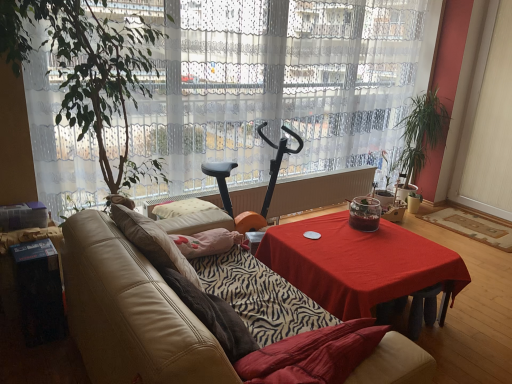
This screenshot has height=384, width=512. In order to click on white plastic radiator at center in this screenshot , I will do `click(319, 190)`.

Where is `transparent glass jar at center`? transparent glass jar at center is located at coordinates (364, 214).

In the scene shown: Measure the distance between point (266, 194) and camera.

A distance of 3.46 meters exists between point (266, 194) and camera.

Where is `red cloth-covered table at center`? The image size is (512, 384). red cloth-covered table at center is located at coordinates (358, 263).

Where is `leather couch at center`? leather couch at center is located at coordinates (131, 313).

Describe the element at coordinates (276, 84) in the screenshot. I see `white sheer curtain at center` at that location.

In order to click on green leafy plant at right, the 1th houseplant when ordered from back to front in this screenshot , I will do `click(421, 132)`.

Is white sheer curtain at center located within transparent glass jar at center?

No, transparent glass jar at center does not contain white sheer curtain at center.

Is transparent glass jar at center far away from white sheer curtain at center?

Yes, transparent glass jar at center and white sheer curtain at center are located far from each other.

From the picture: Which object is wider, transparent glass jar at center or white sheer curtain at center?

Wider between the two is white sheer curtain at center.

From a real-world perspective, is transparent glass jar at center physically located above or below white sheer curtain at center?

In terms of real-world spatial position, transparent glass jar at center is below white sheer curtain at center.

Which of these two, green leafy plant at right, the 1th houseplant when ordered from back to front, or green leafy plant at left, arranged as the first houseplant when viewed from the left, is thinner?

green leafy plant at right, the 1th houseplant when ordered from back to front, is thinner.

Is green leafy plant at right, the 1th houseplant viewed from the right, to the right of green leafy plant at left, arranged as the 1th houseplant when viewed from the front, from the viewer's perspective?

Indeed, green leafy plant at right, the 1th houseplant viewed from the right, is positioned on the right side of green leafy plant at left, arranged as the 1th houseplant when viewed from the front.

Locate an element on the screen. The width and height of the screenshot is (512, 384). houseplant above the green leafy plant at right, the second houseplant when ordered from left to right (from a real-world perspective) is located at coordinates (88, 71).

Looking at the image, does green leafy plant at right, the 1th houseplant viewed from the right, seem bigger or smaller compared to green leafy plant at left, placed as the 2th houseplant when sorted from back to front?

green leafy plant at right, the 1th houseplant viewed from the right, is smaller than green leafy plant at left, placed as the 2th houseplant when sorted from back to front.

Would you say black plastic exercise bike at center is to the left or to the right of leather couch at center in the picture?

Based on their positions, black plastic exercise bike at center is located to the right of leather couch at center.

Consider the image. From a real-world perspective, is black plastic exercise bike at center positioned over leather couch at center based on gravity?

Yes, from a real-world perspective, black plastic exercise bike at center is above leather couch at center.

Is black plastic exercise bike at center spatially inside leather couch at center, or outside of it?

black plastic exercise bike at center is spatially situated outside leather couch at center.

Is black plastic exercise bike at center smaller than leather couch at center?

Correct, black plastic exercise bike at center occupies less space than leather couch at center.

Is white sheer curtain at center directly adjacent to green leafy plant at left, placed as the 2th houseplant when sorted from back to front?

No.

Is white sheer curtain at center bigger or smaller than green leafy plant at left, arranged as the first houseplant when viewed from the left?

In the image, white sheer curtain at center appears to be larger than green leafy plant at left, arranged as the first houseplant when viewed from the left.

Looking at this image, from a real-world perspective, is white sheer curtain at center positioned over green leafy plant at left, arranged as the first houseplant when viewed from the left, based on gravity?

Correct, in the physical world, white sheer curtain at center is higher than green leafy plant at left, arranged as the first houseplant when viewed from the left.

Between white sheer curtain at center and green leafy plant at left, placed as the 2th houseplant when sorted from back to front, which one has larger width?

green leafy plant at left, placed as the 2th houseplant when sorted from back to front, is wider.

Between black plastic exercise bike at center and green leafy plant at right, the 1th houseplant viewed from the right, which one has smaller size?

Smaller between the two is green leafy plant at right, the 1th houseplant viewed from the right.

Is black plastic exercise bike at center facing towards green leafy plant at right, which is the second houseplant from front to back?

No, black plastic exercise bike at center is not aimed at green leafy plant at right, which is the second houseplant from front to back.

Which object is wider, black plastic exercise bike at center or green leafy plant at right, the 1th houseplant when ordered from back to front?

Wider between the two is black plastic exercise bike at center.

Considering the positions of objects black plastic exercise bike at center and green leafy plant at right, which is the second houseplant from front to back, in the image provided, who is more to the left, black plastic exercise bike at center or green leafy plant at right, which is the second houseplant from front to back,?

From the viewer's perspective, black plastic exercise bike at center appears more on the left side.

Between white plastic radiator at center and transparent glass jar at center, which one appears on the left side from the viewer's perspective?

white plastic radiator at center.

Is white plastic radiator at center spatially inside transparent glass jar at center, or outside of it?

white plastic radiator at center is outside transparent glass jar at center.

Is white plastic radiator at center aimed at transparent glass jar at center?

Yes.

From a real-world perspective, relative to transparent glass jar at center, is white plastic radiator at center vertically above or below?

white plastic radiator at center is situated lower than transparent glass jar at center in the real world.

Which object is further away from the camera, green leafy plant at left, placed as the 2th houseplant when sorted from back to front, or white plastic radiator at center?

white plastic radiator at center is more distant.

Looking at this image, which is less distant, (133,38) or (292,206)?

Clearly, point (133,38) is closer to the camera than point (292,206).

Considering the sizes of green leafy plant at left, placed as the 2th houseplant when sorted from right to left, and white plastic radiator at center in the image, is green leafy plant at left, placed as the 2th houseplant when sorted from right to left, wider or thinner than white plastic radiator at center?

Clearly, green leafy plant at left, placed as the 2th houseplant when sorted from right to left, has more width compared to white plastic radiator at center.

Find the location of a particular element. This screenshot has width=512, height=384. curtain on the left of transparent glass jar at center is located at coordinates (276, 84).

At what (x,y) coordinates should I click in order to perform the action: click on houseplant directly beneath the green leafy plant at left, placed as the 2th houseplant when sorted from back to front (from a real-world perspective). Please return your answer as a coordinate pair (x, y). Looking at the image, I should click on (421, 132).

Looking at the image, which one is located closer to green leafy plant at left, arranged as the first houseplant when viewed from the left, black plastic exercise bike at center or green leafy plant at right, the 1th houseplant viewed from the right?

The object closer to green leafy plant at left, arranged as the first houseplant when viewed from the left, is black plastic exercise bike at center.

Estimate the real-world distances between objects in this image. Which object is further from red cloth-covered table at center, white sheer curtain at center or white plastic radiator at center?

Based on the image, white sheer curtain at center appears to be further to red cloth-covered table at center.

When comparing their distances from white plastic radiator at center, does transparent glass jar at center or black plastic exercise bike at center seem further?

Based on the image, transparent glass jar at center appears to be further to white plastic radiator at center.

When comparing their distances from white sheer curtain at center, does black plastic exercise bike at center or green leafy plant at right, which is the second houseplant from front to back, seem further?

green leafy plant at right, which is the second houseplant from front to back.

In the scene shown: Which object lies nearer to the anchor point white plastic radiator at center, transparent glass jar at center or red cloth-covered table at center?

transparent glass jar at center lies closer to white plastic radiator at center than the other object.

Looking at the image, which one is located further to leather couch at center, red cloth-covered table at center or white plastic radiator at center?

white plastic radiator at center is positioned further to the anchor leather couch at center.

From the image, which object appears to be nearer to leather couch at center, black plastic exercise bike at center or white sheer curtain at center?

Based on the image, white sheer curtain at center appears to be nearer to leather couch at center.

Based on their spatial positions, is white plastic radiator at center or green leafy plant at left, arranged as the first houseplant when viewed from the left, closer to leather couch at center?

green leafy plant at left, arranged as the first houseplant when viewed from the left.

Identify the location of desk between green leafy plant at left, placed as the 2th houseplant when sorted from back to front, and green leafy plant at right, which is the second houseplant from front to back, from left to right. The image size is (512, 384). pos(358,263).

Image resolution: width=512 pixels, height=384 pixels. I want to click on coffee cup between white sheer curtain at center and red cloth-covered table at center from top to bottom, so click(364, 214).

The height and width of the screenshot is (384, 512). In order to click on curtain between leather couch at center and black plastic exercise bike at center in the front-back direction in this screenshot , I will do click(276, 84).

At what (x,y) coordinates should I click in order to perform the action: click on baby carriage between green leafy plant at left, arranged as the 1th houseplant when viewed from the front, and transparent glass jar at center, in the horizontal direction. Please return your answer as a coordinate pair (x, y). Looking at the image, I should click on (280, 143).